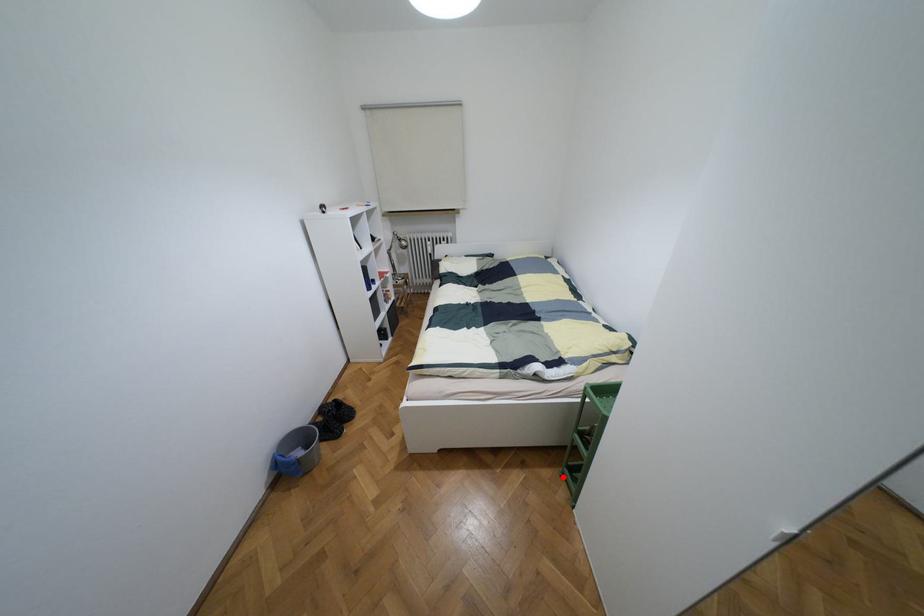
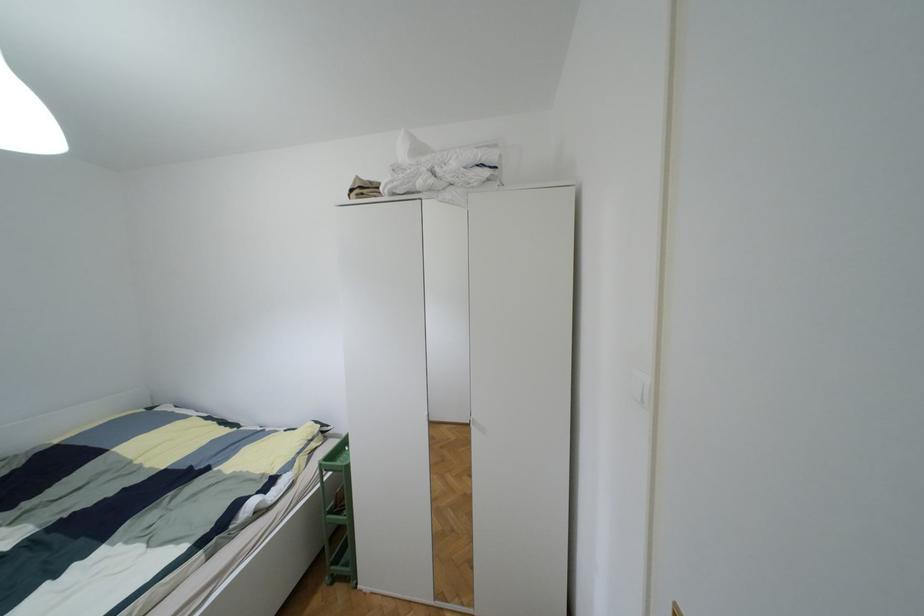
Question: A red point is marked in image1. In image2, is the corresponding 3D point closer to the camera or farther? Reply with the corresponding letter.

Choices:
 (A) The corresponding 3D point is closer.
 (B) The corresponding 3D point is farther.

Answer: (B)